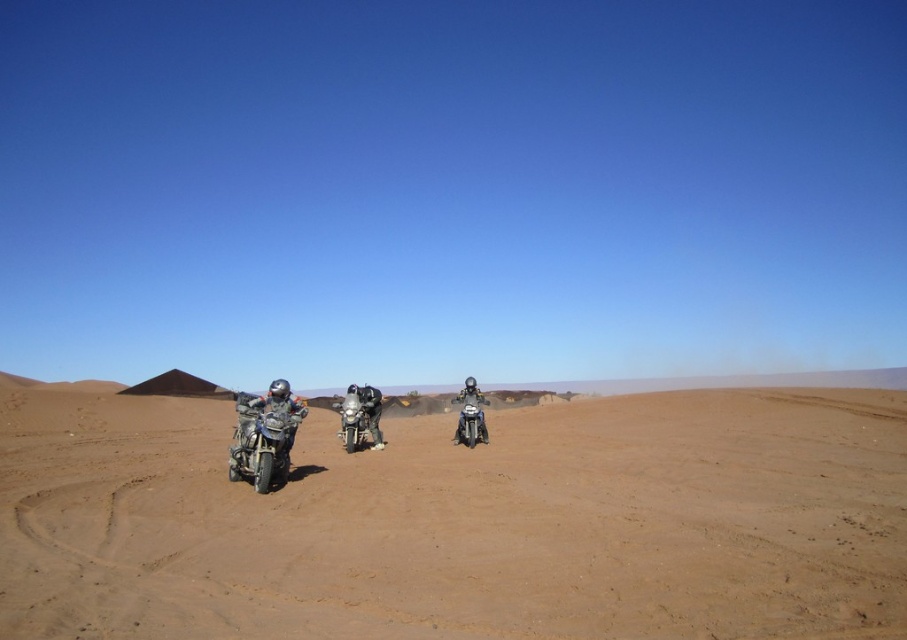
Is metallic silver motorcycle at left bigger than matte black motorcycle at center?

Indeed, metallic silver motorcycle at left has a larger size compared to matte black motorcycle at center.

Is metallic silver motorcycle at left wider than matte black motorcycle at center?

Indeed, metallic silver motorcycle at left has a greater width compared to matte black motorcycle at center.

Locate an element on the screen. The image size is (907, 640). metallic silver motorcycle at left is located at coordinates (262, 438).

Find the location of a particular element. Image resolution: width=907 pixels, height=640 pixels. metallic silver motorcycle at left is located at coordinates (262, 438).

Describe the element at coordinates (460, 522) in the screenshot. I see `brown sandy dirt at center` at that location.

Does point (198, 429) come closer to viewer compared to point (476, 396)?

No, it is behind (476, 396).

This screenshot has width=907, height=640. In order to click on brown sandy dirt at center in this screenshot , I will do `click(460, 522)`.

Does point (281, 401) come in front of point (478, 403)?

Yes, point (281, 401) is in front of point (478, 403).

Which is above, metallic silver motorcycle at left or metallic silver motorcycle at center?

metallic silver motorcycle at left is above.

Describe the element at coordinates (262, 438) in the screenshot. I see `metallic silver motorcycle at left` at that location.

You are a GUI agent. You are given a task and a screenshot of the screen. Output one action in this format:
    pyautogui.click(x=<x>, y=<y>)
    Task: Click on the metallic silver motorcycle at left
    Image resolution: width=907 pixels, height=640 pixels.
    Given the screenshot: What is the action you would take?
    pyautogui.click(x=262, y=438)